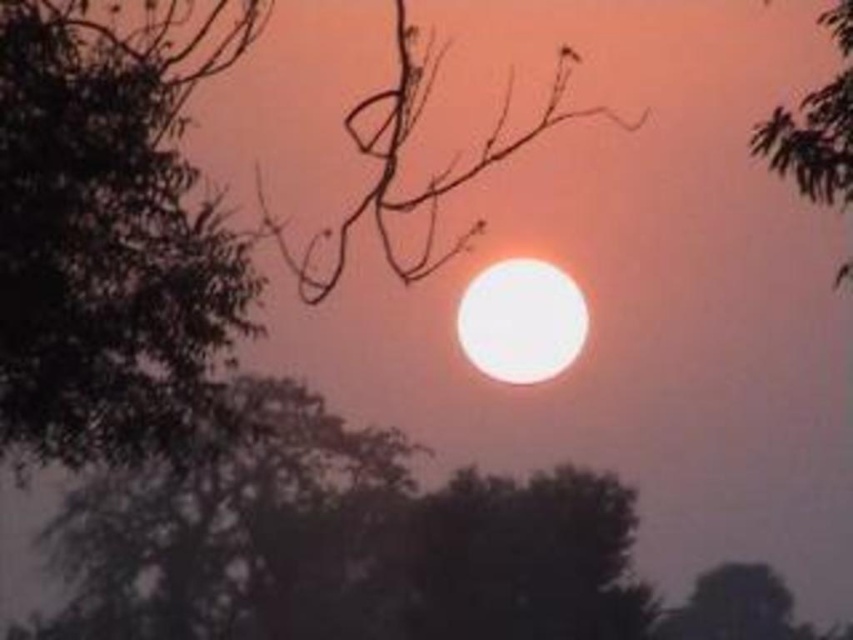
Question: Estimate the real-world distances between objects in this image. Which object is farther from the green leafy tree at upper right?

Choices:
 (A) green leafy tree at left
 (B) brown matte branch at center

Answer: (B)

Question: Which of the following is the closest to the observer?

Choices:
 (A) (97, 349)
 (B) (322, 451)

Answer: (A)

Question: From the image, what is the correct spatial relationship of brown matte branch at center in relation to green leafy tree at upper right?

Choices:
 (A) left
 (B) right

Answer: (A)

Question: Which point is closer to the camera?

Choices:
 (A) dark green leafy tree at lower left
 (B) green leafy tree at upper right
 (C) green leafy tree at left
 (D) brown matte branch at center

Answer: (D)

Question: In this image, where is brown matte branch at center located relative to green leafy tree at upper right?

Choices:
 (A) right
 (B) left

Answer: (B)

Question: Is green leafy tree at left above dark green leafy tree at lower left?

Choices:
 (A) no
 (B) yes

Answer: (B)